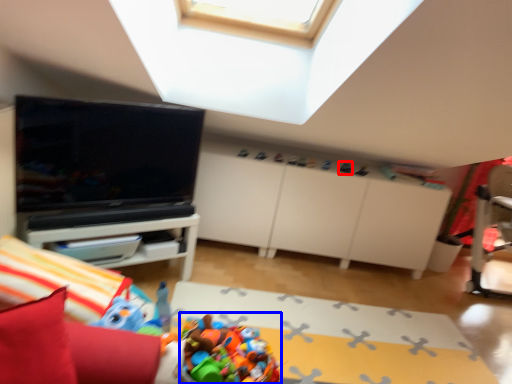
Question: Which object appears farthest to the camera in this image, toy (highlighted by a red box) or toy (highlighted by a blue box)?

Choices:
 (A) toy
 (B) toy

Answer: (A)